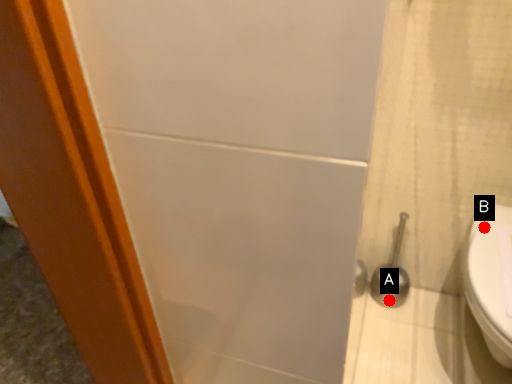
Question: Two points are circled on the image, labeled by A and B beside each circle. Which of the following is the farthest from the observer?

Choices:
 (A) A is further
 (B) B is further

Answer: (A)